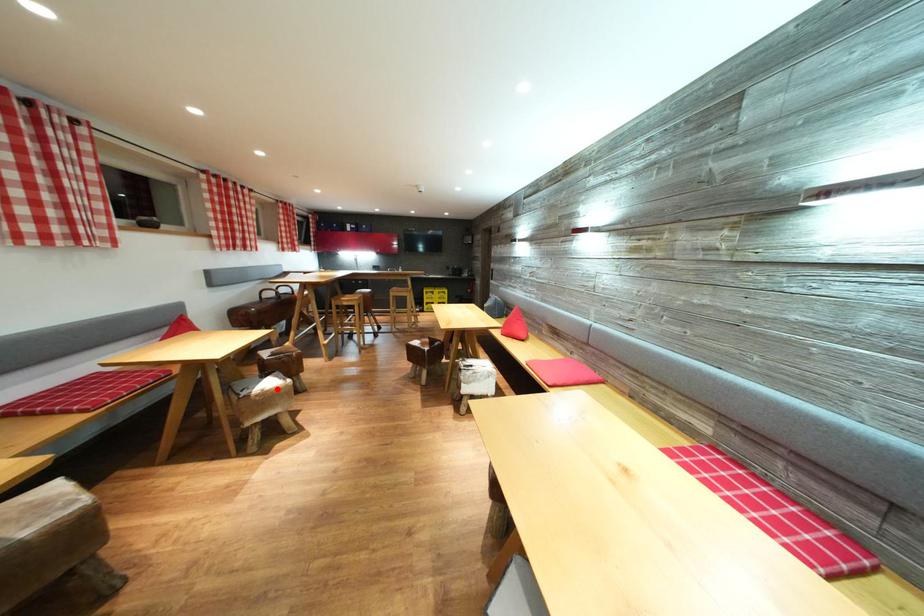
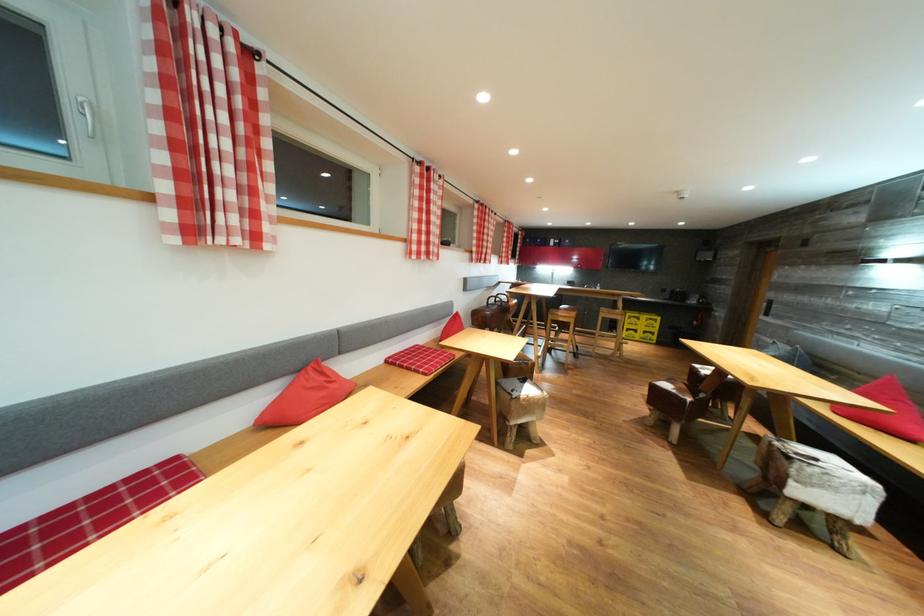
Question: A red point is marked in image1. In image2, is the corresponding 3D point closer to the camera or farther? Reply with the corresponding letter.

Choices:
 (A) The corresponding 3D point is closer.
 (B) The corresponding 3D point is farther.

Answer: (B)